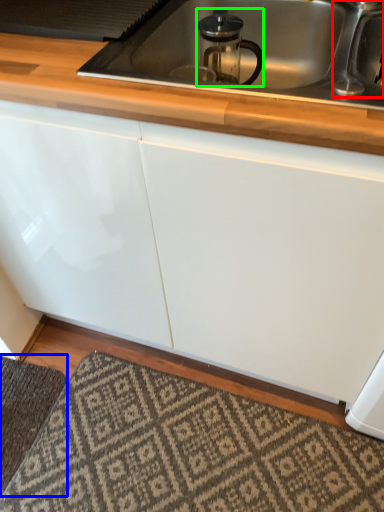
Question: Which object is positioned farthest from faucet (highlighted by a red box)? Select from doormat (highlighted by a blue box) and appliance (highlighted by a green box).

Choices:
 (A) doormat
 (B) appliance

Answer: (A)